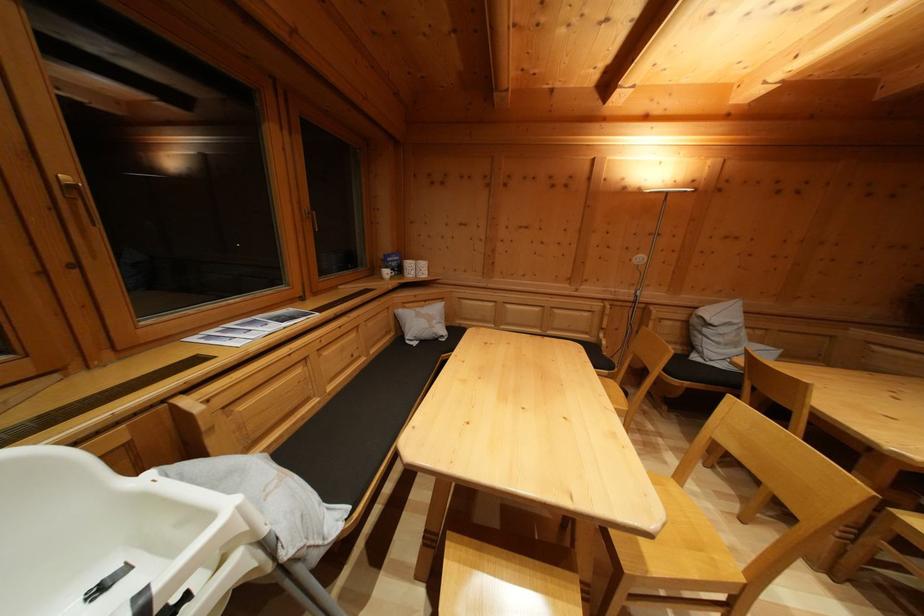
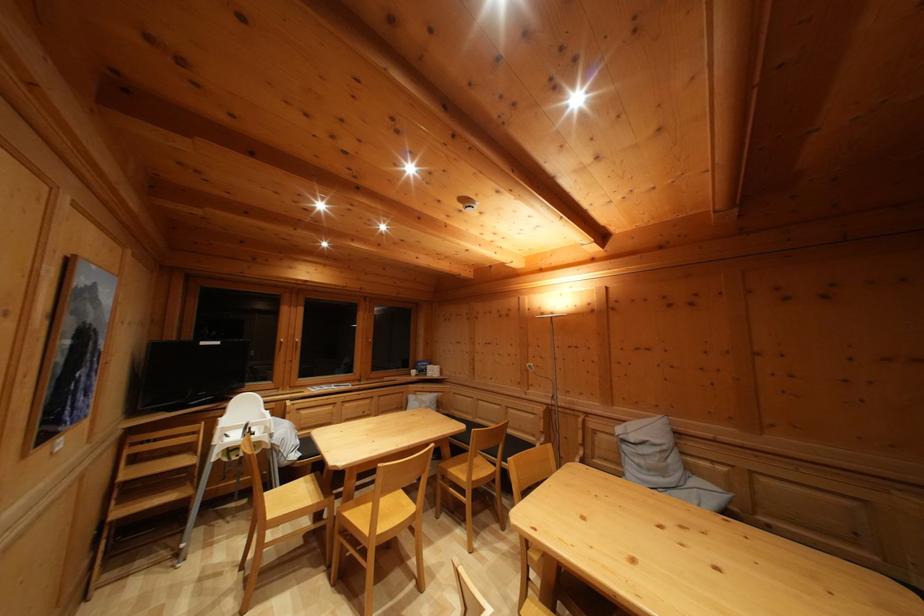
Where in the second image is the point corresponding to the point at 711,337 from the first image?

(629, 454)